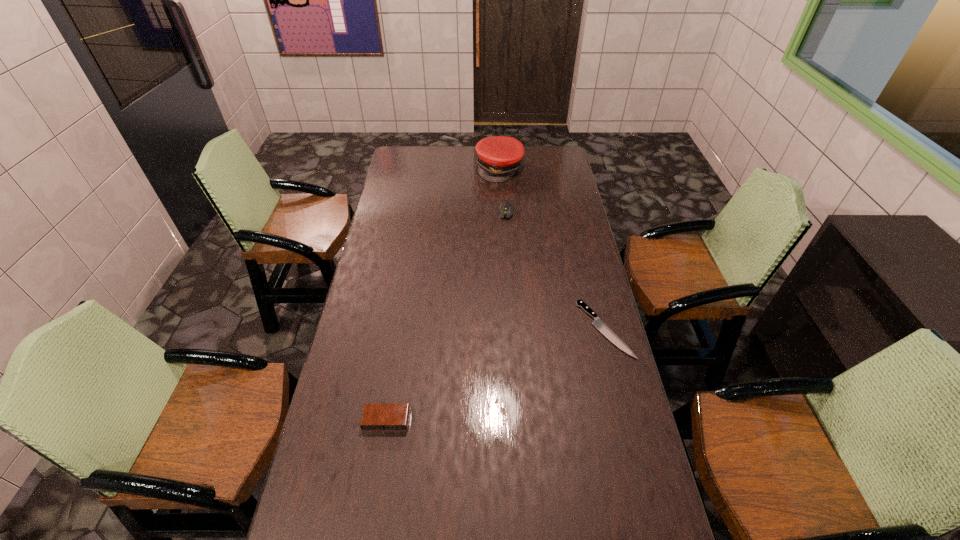
Identify the location of the leftmost object. (376, 417).

Locate an element on the screen. This screenshot has width=960, height=540. the second shortest object is located at coordinates (376, 417).

Locate an element on the screen. This screenshot has height=540, width=960. the shortest object is located at coordinates (598, 323).

The height and width of the screenshot is (540, 960). What are the coordinates of `steak knife` in the screenshot? It's located at (598, 323).

The width and height of the screenshot is (960, 540). What are the coordinates of `computer mouse` in the screenshot? It's located at (506, 209).

Locate an element on the screen. the second farthest object is located at coordinates (506, 209).

At what (x,y) coordinates should I click in order to perform the action: click on cap. Please return your answer as a coordinate pair (x, y). Looking at the image, I should click on [498, 157].

I want to click on the tallest object, so click(498, 157).

Where is `free location located 0.240m on the front face of the third tallest object`? The height and width of the screenshot is (540, 960). free location located 0.240m on the front face of the third tallest object is located at coordinates (370, 524).

Identify the location of free space located 0.270m on the back of the rightmost object. The image size is (960, 540). (586, 252).